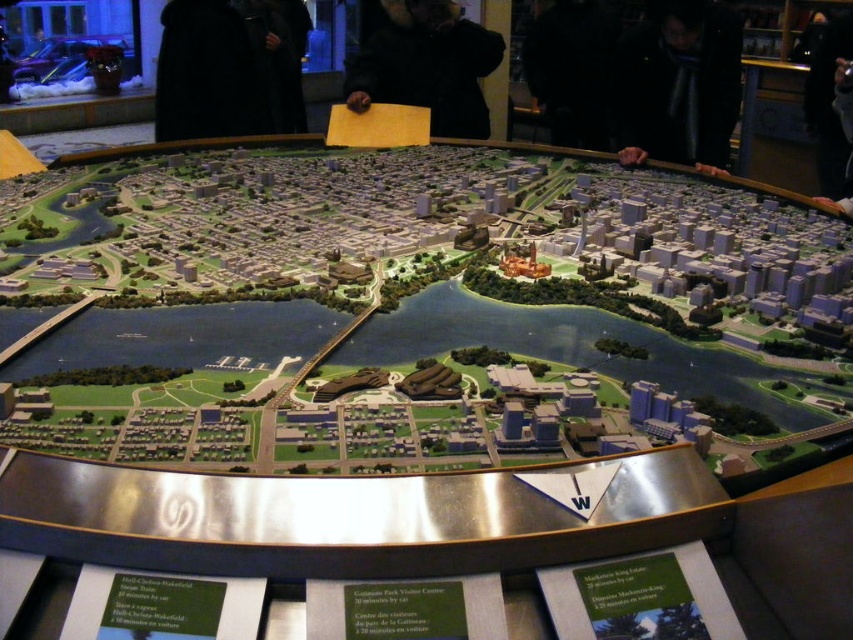
Question: Is black matte jacket at upper center smaller than black fuzzy coat at upper center?

Choices:
 (A) yes
 (B) no

Answer: (A)

Question: Is black matte jacket at upper center below black fuzzy coat at upper center?

Choices:
 (A) no
 (B) yes

Answer: (B)

Question: Can you confirm if black matte jacket at upper center is positioned below black fuzzy coat at upper center?

Choices:
 (A) yes
 (B) no

Answer: (A)

Question: Which point is farther to the camera?

Choices:
 (A) black fuzzy coat at upper center
 (B) black matte jacket at upper center

Answer: (B)

Question: Which of the following is the closest to the observer?

Choices:
 (A) black fuzzy coat at upper center
 (B) black matte jacket at upper center

Answer: (A)